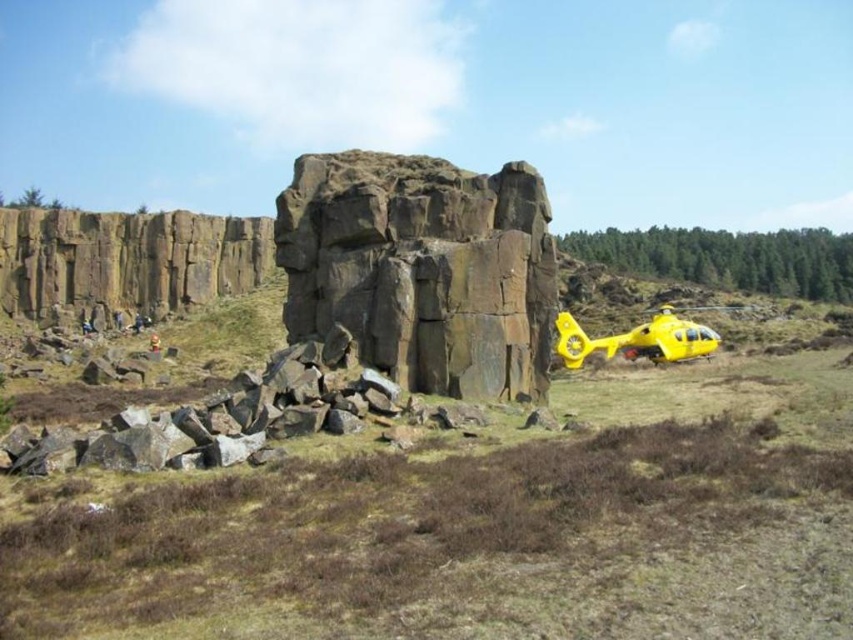
You are a park ranger in this rugged outdoor scene. You need to place a new warning sign between the yellow plastic helicopter at right and the yellow matte helicopter at right. The sign requires a minimum of 20 meters of space between the two helicopters to be safely positioned. Can you confirm if the current distance allows for this?

The yellow plastic helicopter at right is 21.72 meters from the yellow matte helicopter at right. Since 21.72 meters exceeds the required 20 meters, the warning sign can be safely placed between them with the necessary spacing.

You are a photographer planning to capture the dark gray stone rock at center and the yellow matte helicopter at right in a single frame. Based on their sizes in the image, which object should you focus on first if you want to ensure both are in focus?

The dark gray stone rock at center occupies less space than the yellow matte helicopter at right, so you should focus on the yellow matte helicopter at right first since it is larger and will require more precise focusing to ensure both are in focus.